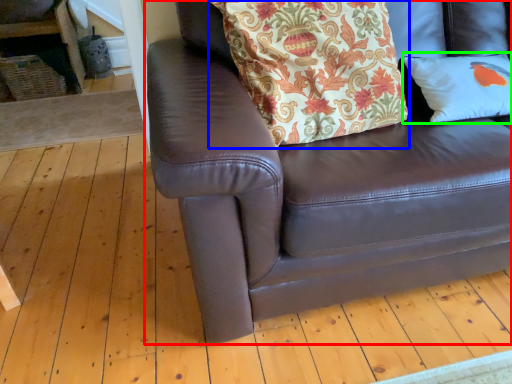
Question: Considering the real-world distances, which object is closest to studio couch (highlighted by a red box)? blanket (highlighted by a blue box) or pillow (highlighted by a green box).

Choices:
 (A) blanket
 (B) pillow

Answer: (A)